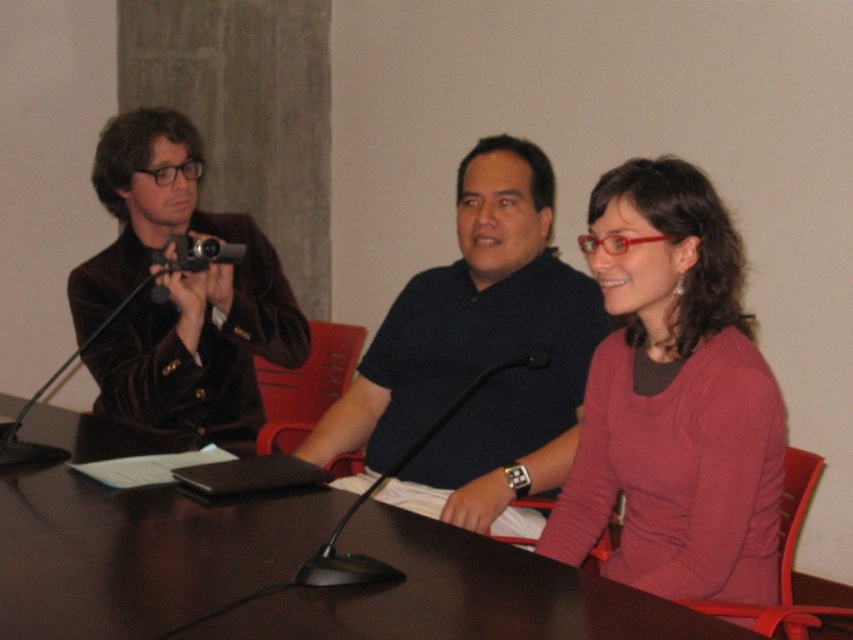
Between pink sweater at center and black plastic microphone at center, which one appears on the right side from the viewer's perspective?

Positioned to the right is pink sweater at center.

Does pink sweater at center have a larger size compared to black plastic microphone at center?

No.

At what (x,y) coordinates should I click in order to perform the action: click on pink sweater at center. Please return your answer as a coordinate pair (x, y). The height and width of the screenshot is (640, 853). Looking at the image, I should click on 672,400.

Does pink sweater at center have a greater width compared to dark blue polo shirt at center?

No, pink sweater at center is not wider than dark blue polo shirt at center.

Which is behind, point (643, 387) or point (554, 355)?

Positioned behind is point (554, 355).

Between point (763, 390) and point (467, 236), which one is positioned in front?

Point (763, 390) is in front.

Image resolution: width=853 pixels, height=640 pixels. Find the location of `pink sweater at center`. pink sweater at center is located at coordinates (672, 400).

At what (x,y) coordinates should I click in order to perform the action: click on dark blue polo shirt at center. Please return your answer as a coordinate pair (x, y). The width and height of the screenshot is (853, 640). Looking at the image, I should click on (476, 358).

Is dark blue polo shirt at center positioned behind velvet brown jacket at left?

No, it is in front of velvet brown jacket at left.

Image resolution: width=853 pixels, height=640 pixels. Find the location of `dark blue polo shirt at center`. dark blue polo shirt at center is located at coordinates (476, 358).